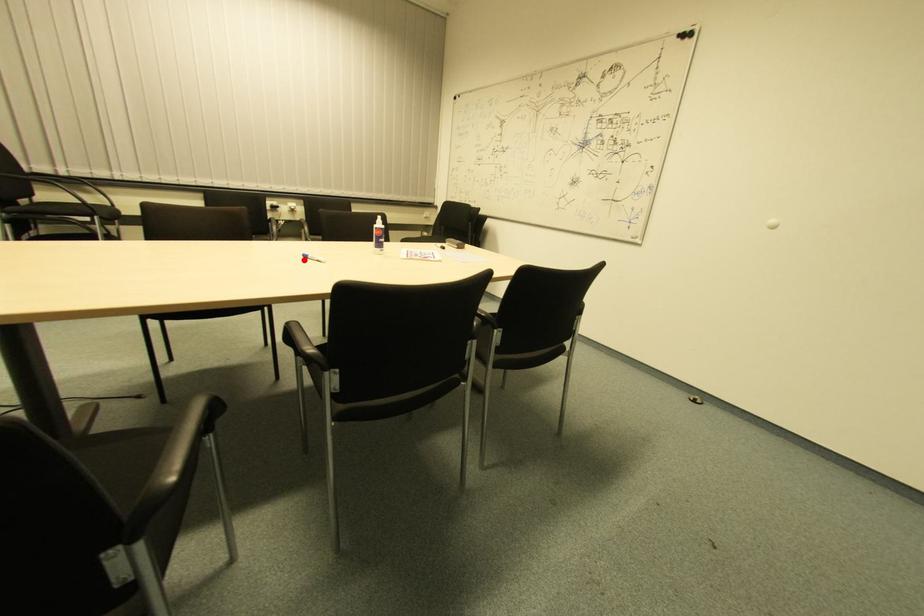
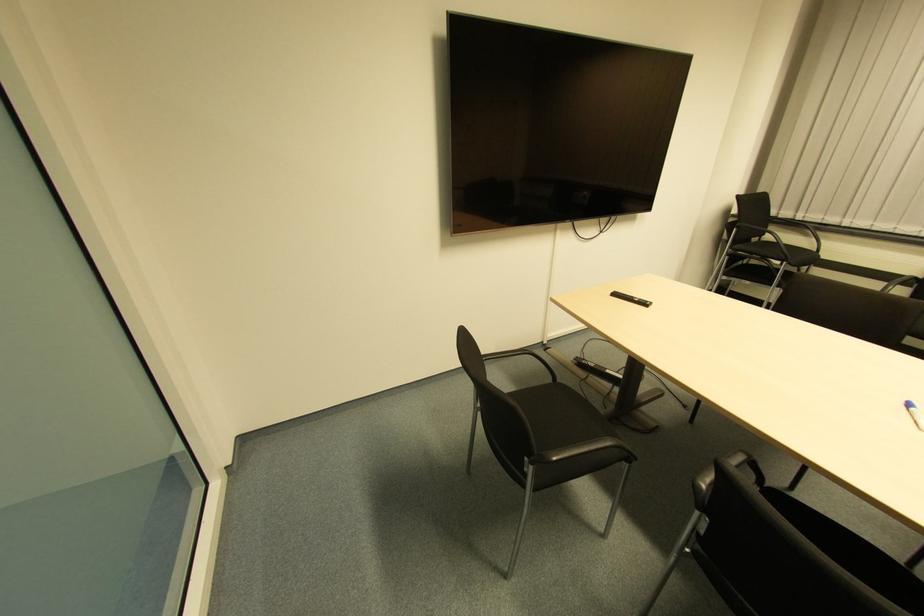
In the second image, find the point that corresponds to the highlighted location in the first image.

(907, 408)